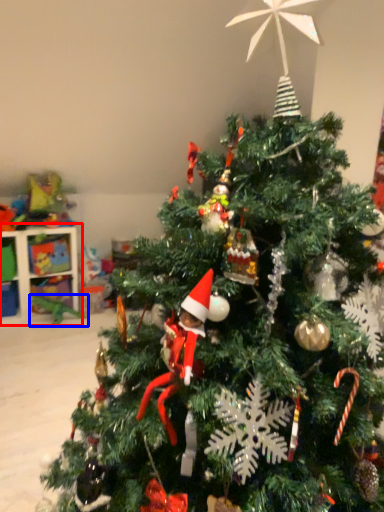
Question: Which point is further to the camera, shelf (highlighted by a red box) or toy (highlighted by a blue box)?

Choices:
 (A) shelf
 (B) toy

Answer: (B)